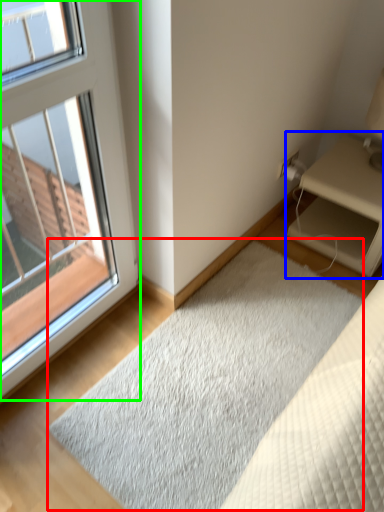
Question: Which object is the closest to the doormat (highlighted by a red box)? Choose among these: nightstand (highlighted by a blue box) or window (highlighted by a green box).

Choices:
 (A) nightstand
 (B) window

Answer: (A)